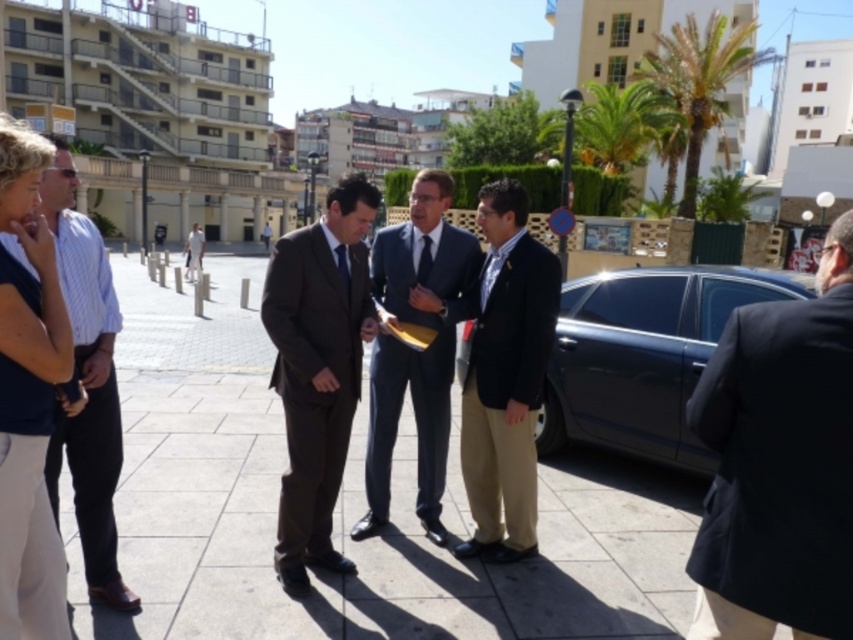
Question: Is khaki cotton pants at center positioned before dark blue suit at center?

Choices:
 (A) no
 (B) yes

Answer: (B)

Question: Can you confirm if dark blue suit at right is positioned to the left of metallic gray sedan at right?

Choices:
 (A) yes
 (B) no

Answer: (A)

Question: Which point appears farthest from the camera in this image?

Choices:
 (A) (115, 394)
 (B) (16, 605)
 (C) (364, 276)
 (D) (619, 419)

Answer: (D)

Question: From the image, what is the correct spatial relationship of dark blue suit at right in relation to dark brown suit at center?

Choices:
 (A) above
 (B) below

Answer: (B)

Question: Which of these objects is positioned closest to the light blue striped fabric business suit at left?

Choices:
 (A) metallic gray sedan at right
 (B) dark blue suit at right
 (C) dark blue fabric shirt at left
 (D) dark brown suit at center

Answer: (C)

Question: Which of the following is the closest to the observer?

Choices:
 (A) khaki cotton pants at center
 (B) dark blue suit at center
 (C) dark brown suit at center
 (D) light blue striped fabric business suit at left

Answer: (D)